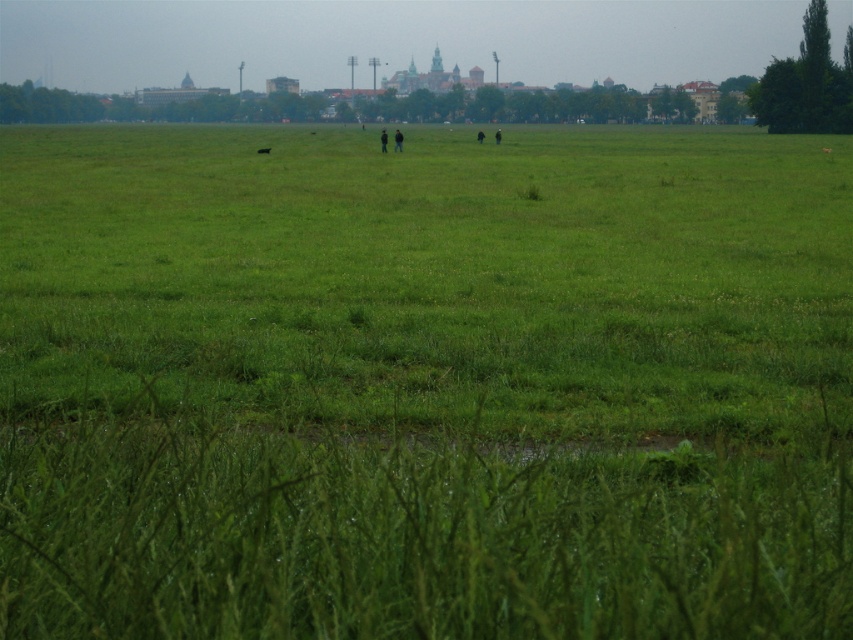
Based on the photo, is black matte person at center positioned behind green grass at center?

No.

In the scene shown: Between black matte person at center and green grass at center, which one appears on the right side from the viewer's perspective?

Positioned to the right is black matte person at center.

Is point (381, 150) positioned before point (259, 150)?

No, it is not.

Find the location of a particular element. This screenshot has width=853, height=640. black matte person at center is located at coordinates (383, 140).

Is black matte person at center closer to camera compared to dark green grass at center?

Yes, black matte person at center is closer to the viewer.

Does black matte person at center have a greater height compared to dark green grass at center?

Yes.

Is point (384, 141) more distant than point (498, 140)?

No, it is not.

The image size is (853, 640). What are the coordinates of `black matte person at center` in the screenshot? It's located at (383, 140).

Can you confirm if green grass pasture at center is taller than black matte person at center?

Yes, green grass pasture at center is taller than black matte person at center.

Is point (593, 152) more distant than point (381, 138)?

That is True.

Locate an element on the screen. green grass pasture at center is located at coordinates (431, 276).